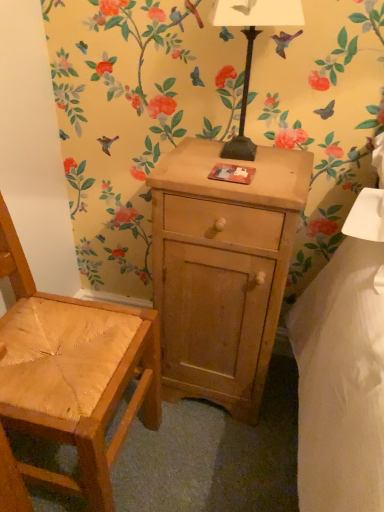
This screenshot has width=384, height=512. Find the location of `blank space above light brown wood cabinet at center (from a real-world perspective)`. blank space above light brown wood cabinet at center (from a real-world perspective) is located at coordinates (238, 168).